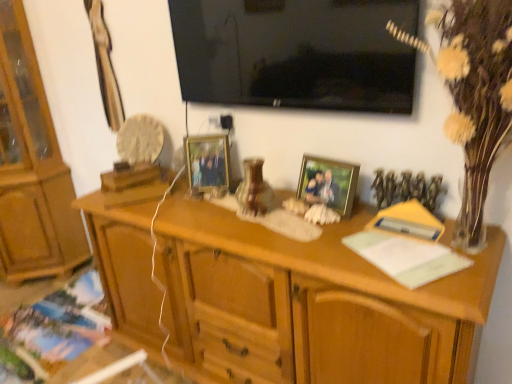
You are a GUI agent. You are given a task and a screenshot of the screen. Output one action in this format:
    pyautogui.click(x=<x>, y=<y>)
    Task: Click on the vacant area to the left of white paper at right, arranged as the 2th book when ordered from the bottom
    
    Given the screenshot: What is the action you would take?
    pyautogui.click(x=333, y=266)